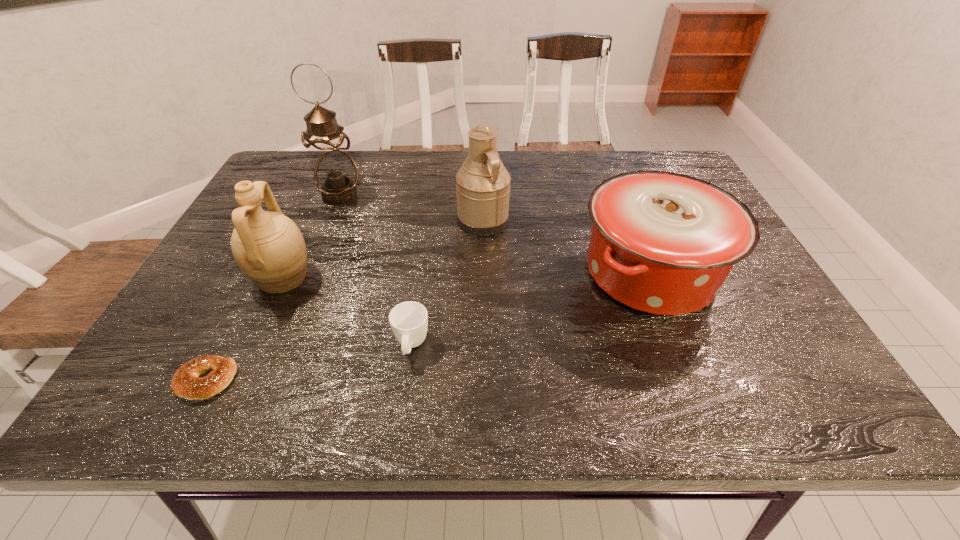
Identify the location of free space located on the front of the fifth object from left to right. Image resolution: width=960 pixels, height=540 pixels. tap(484, 282).

The height and width of the screenshot is (540, 960). What are the coordinates of `vacant region located on the front of the left pitcher` in the screenshot? It's located at (261, 324).

Where is `free space located 0.290m on the back of the rightmost object`? The height and width of the screenshot is (540, 960). free space located 0.290m on the back of the rightmost object is located at coordinates (609, 170).

You are a GUI agent. You are given a task and a screenshot of the screen. Output one action in this format:
    pyautogui.click(x=<x>, y=<y>)
    Task: Click on the free space located 0.100m on the right of the bagel
    The height and width of the screenshot is (540, 960).
    Given the screenshot: What is the action you would take?
    pyautogui.click(x=288, y=381)

Where is `object that is at the far edge`? object that is at the far edge is located at coordinates (335, 174).

The width and height of the screenshot is (960, 540). Identify the location of object that is at the near edge. (186, 383).

At what (x,y) coordinates should I click in order to perform the action: click on pitcher positioned at the left edge. Please return your answer as a coordinate pair (x, y). The image size is (960, 540). Looking at the image, I should click on (269, 248).

Where is `bagel that is at the left edge`? bagel that is at the left edge is located at coordinates (x=186, y=383).

I want to click on object located in the right edge section of the desktop, so click(x=663, y=243).

Locate an element on the screen. The height and width of the screenshot is (540, 960). object located in the near left corner section of the desktop is located at coordinates (186, 383).